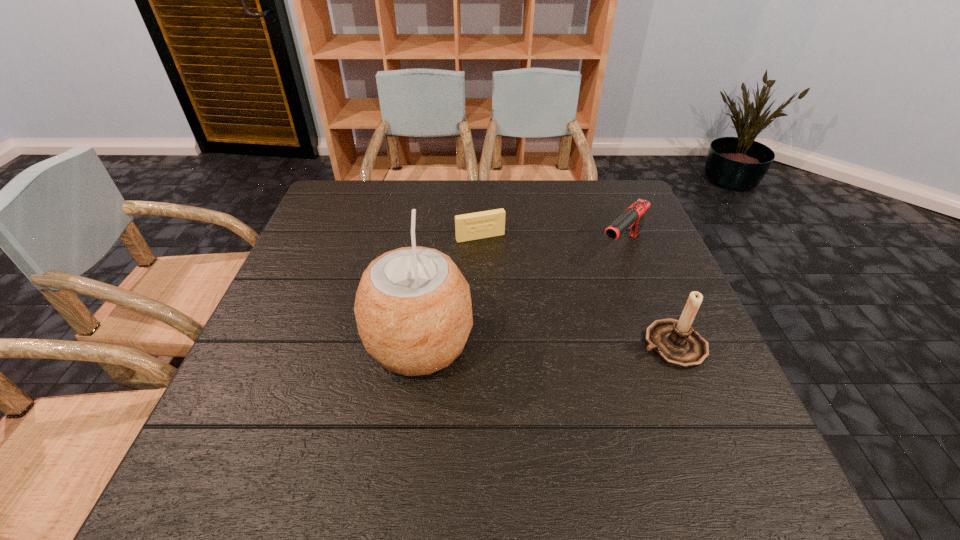
Find the location of a particular element. This screenshot has width=960, height=540. the tallest object is located at coordinates (413, 310).

At what (x,y) coordinates should I click in order to perform the action: click on the second tallest object. Please return your answer as a coordinate pair (x, y). This screenshot has width=960, height=540. Looking at the image, I should click on (675, 342).

Where is `videotape`? videotape is located at coordinates (485, 224).

Identify the location of the second shortest object. (633, 217).

The width and height of the screenshot is (960, 540). Find the location of `vacant area situated on the left of the tallest object`. vacant area situated on the left of the tallest object is located at coordinates click(x=342, y=342).

Where is `blank space located on the left of the candle holder`? Image resolution: width=960 pixels, height=540 pixels. blank space located on the left of the candle holder is located at coordinates (468, 345).

At what (x,y) coordinates should I click in order to perform the action: click on vacant space located at the front of the videotape with spools. Please return your answer as a coordinate pair (x, y). Looking at the image, I should click on (538, 350).

The height and width of the screenshot is (540, 960). In order to click on vacant space situated 0.210m at the front of the videotape with spools in this screenshot , I will do `click(512, 295)`.

Locate an element on the screen. vacant space situated 0.060m at the front of the videotape with spools is located at coordinates (493, 256).

Where is `vacant space located 0.270m at the aiming end of the third tallest object`? This screenshot has height=540, width=960. vacant space located 0.270m at the aiming end of the third tallest object is located at coordinates (549, 322).